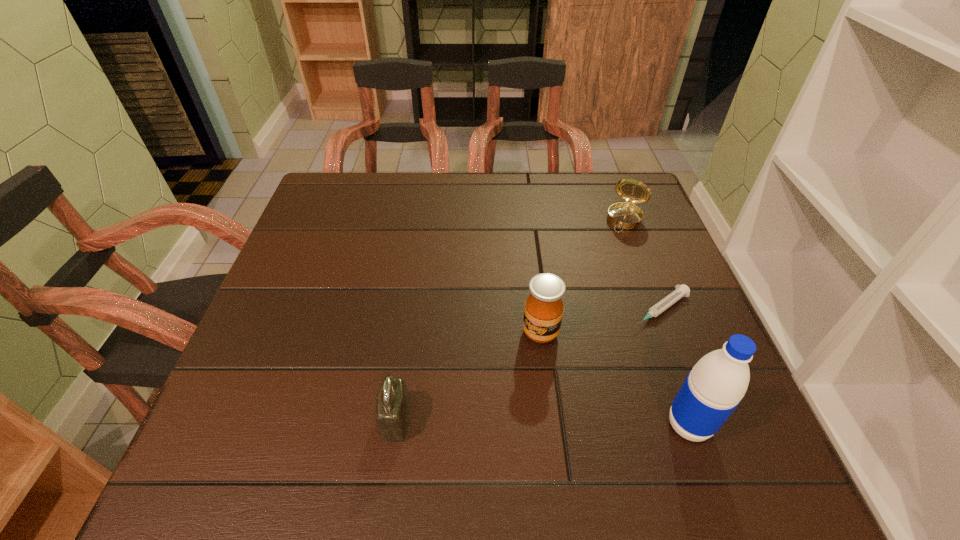
I want to click on vacant region located 0.210m with the dial facing the farthest object, so click(x=595, y=281).

Where is `vacant space situated with the dial facing the farthest object`? This screenshot has height=540, width=960. vacant space situated with the dial facing the farthest object is located at coordinates (598, 276).

Find the location of a particular element. free spot located 0.300m with the dial facing the farthest object is located at coordinates (583, 307).

Identify the location of free spot located at the needle end of the shortest object. This screenshot has height=540, width=960. (521, 407).

Locate an element on the screen. This screenshot has width=960, height=540. vacant region located 0.090m at the needle end of the shortest object is located at coordinates (610, 342).

I want to click on free space located 0.130m at the needle end of the shortest object, so click(x=596, y=352).

Find the location of a particular element. vacant space located on the front-facing side of the second object from left to right is located at coordinates (497, 426).

The image size is (960, 540). Find the location of `vacant space located 0.130m on the front-facing side of the second object from left to right`. vacant space located 0.130m on the front-facing side of the second object from left to right is located at coordinates (510, 398).

Where is `vacant space located 0.140m on the front-facing side of the second object from left to right`? Image resolution: width=960 pixels, height=540 pixels. vacant space located 0.140m on the front-facing side of the second object from left to right is located at coordinates (508, 403).

Locate an element on the screen. The height and width of the screenshot is (540, 960). object that is at the far edge is located at coordinates (626, 215).